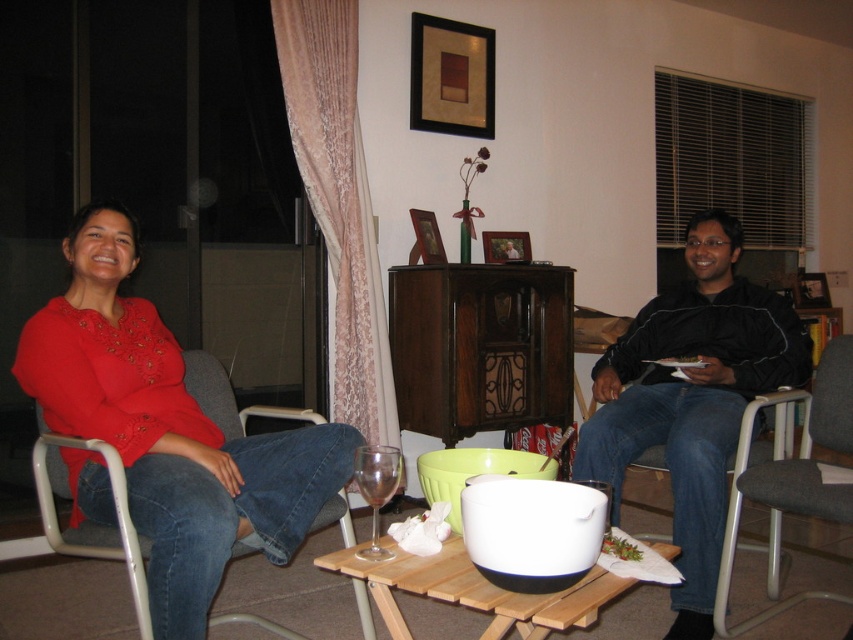
Question: Is matte red sweater at left closer to the viewer compared to black softshell jacket at right?

Choices:
 (A) yes
 (B) no

Answer: (A)

Question: Which object is farther from the camera taking this photo?

Choices:
 (A) matte red sweater at left
 (B) metallic gray armchair at right
 (C) black softshell jacket at right

Answer: (C)

Question: Is metallic gray armchair at right thinner than wooden tray at center?

Choices:
 (A) no
 (B) yes

Answer: (B)

Question: Can you confirm if matte gray armchair at left is positioned to the right of transparent glass wine glass at center?

Choices:
 (A) yes
 (B) no

Answer: (B)

Question: Which of the following is the farthest from the observer?

Choices:
 (A) (106, 540)
 (B) (219, 554)

Answer: (A)

Question: Which point is closer to the camera?

Choices:
 (A) (219, 442)
 (B) (390, 492)
 (C) (717, 486)

Answer: (B)